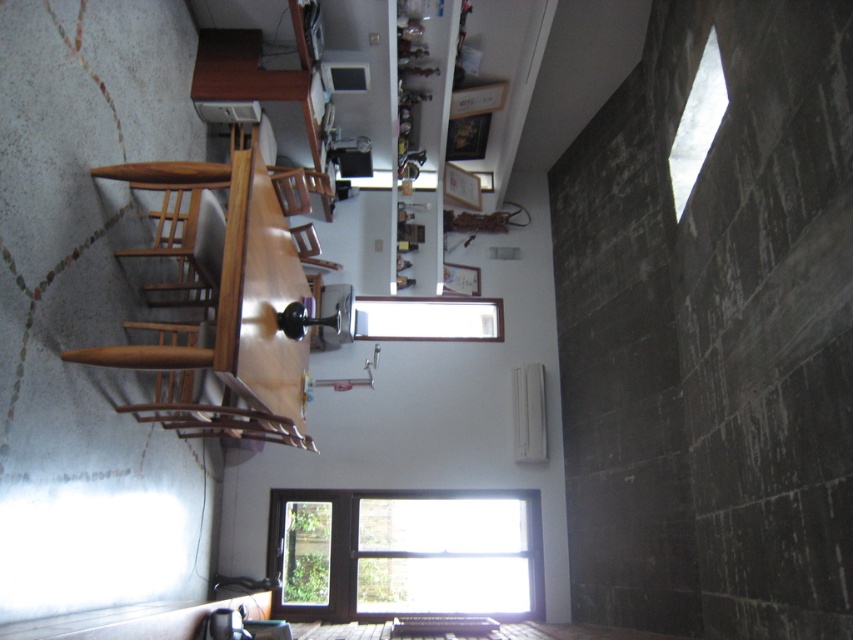
Question: Which point appears closest to the camera in this image?

Choices:
 (A) (445, 580)
 (B) (315, 244)
 (C) (680, 147)

Answer: (C)

Question: Is transparent glass window at center smaller than wooden chair at center?

Choices:
 (A) no
 (B) yes

Answer: (A)

Question: Can you confirm if transparent glass window at center is positioned below clear glass window at upper center?

Choices:
 (A) no
 (B) yes

Answer: (B)

Question: Which is nearer to the clear glass window at upper center?

Choices:
 (A) transparent glass window at center
 (B) wooden chair at center

Answer: (B)

Question: Considering the relative positions of transparent glass window at center and clear glass window at upper center in the image provided, where is transparent glass window at center located with respect to clear glass window at upper center?

Choices:
 (A) left
 (B) right

Answer: (A)

Question: Which of these objects is positioned closest to the wooden chair at center?

Choices:
 (A) clear glass window at upper center
 (B) transparent glass window at center

Answer: (B)